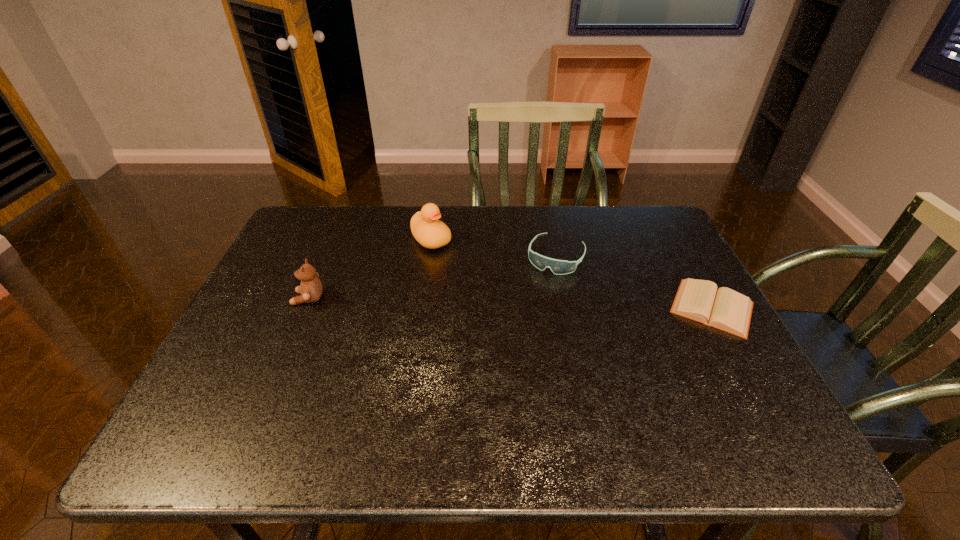
Find the location of a particular element. free space that is in between the rightmost object and the third tallest object is located at coordinates (634, 282).

Locate an element on the screen. The width and height of the screenshot is (960, 540). free space that is in between the second object from right to left and the teddy bear is located at coordinates tap(432, 277).

Find the location of a particular element. This screenshot has height=540, width=960. empty location between the second shortest object and the third object from right to left is located at coordinates (493, 248).

Locate an element on the screen. The height and width of the screenshot is (540, 960). free space between the goggles and the rightmost object is located at coordinates (634, 282).

Locate an element on the screen. vacant space that's between the second object from right to left and the teddy bear is located at coordinates tap(432, 277).

In order to click on free area in between the teddy bear and the second shortest object in this screenshot , I will do `click(432, 277)`.

Point out which object is positioned as the third nearest to the rightmost object. Please provide its 2D coordinates. Your answer should be formatted as a tuple, i.e. [(x, y)], where the tuple contains the x and y coordinates of a point satisfying the conditions above.

[(311, 288)]

Choose which object is the second nearest neighbor to the teddy bear. Please provide its 2D coordinates. Your answer should be formatted as a tuple, i.e. [(x, y)], where the tuple contains the x and y coordinates of a point satisfying the conditions above.

[(559, 267)]

What are the coordinates of `vacant region that satisfies the following two spatial constraints: 1. on the front side of the rightmost object; 2. on the left side of the duck` in the screenshot? It's located at (421, 307).

Image resolution: width=960 pixels, height=540 pixels. Identify the location of vacant space that satisfies the following two spatial constraints: 1. on the front side of the third object from left to right; 2. on the right side of the shortest object. (566, 307).